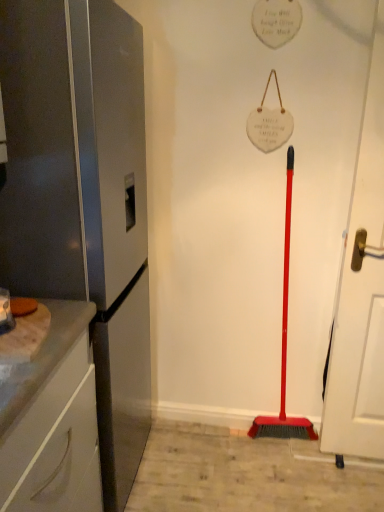
Question: From a real-world perspective, does satin silver refrigerator at left sit lower than white glossy cabinet at left?

Choices:
 (A) yes
 (B) no

Answer: (B)

Question: Does satin silver refrigerator at left appear on the right side of white glossy cabinet at left?

Choices:
 (A) no
 (B) yes

Answer: (B)

Question: From the image's perspective, is satin silver refrigerator at left located above white glossy cabinet at left?

Choices:
 (A) no
 (B) yes

Answer: (B)

Question: Are satin silver refrigerator at left and white glossy cabinet at left located far from each other?

Choices:
 (A) no
 (B) yes

Answer: (A)

Question: Can you confirm if satin silver refrigerator at left is taller than white glossy cabinet at left?

Choices:
 (A) yes
 (B) no

Answer: (A)

Question: Does satin silver refrigerator at left have a lesser width compared to white glossy cabinet at left?

Choices:
 (A) no
 (B) yes

Answer: (A)

Question: Considering the relative positions of satin silver refrigerator at left and white matte door at right in the image provided, is satin silver refrigerator at left to the right of white matte door at right from the viewer's perspective?

Choices:
 (A) yes
 (B) no

Answer: (B)

Question: Is satin silver refrigerator at left outside white matte door at right?

Choices:
 (A) no
 (B) yes

Answer: (B)

Question: Is satin silver refrigerator at left looking in the opposite direction of white matte door at right?

Choices:
 (A) yes
 (B) no

Answer: (B)

Question: From a real-world perspective, is satin silver refrigerator at left physically below white matte door at right?

Choices:
 (A) no
 (B) yes

Answer: (B)

Question: Is satin silver refrigerator at left taller than white matte door at right?

Choices:
 (A) no
 (B) yes

Answer: (A)

Question: Considering the relative positions of satin silver refrigerator at left and white matte door at right in the image provided, is satin silver refrigerator at left to the left of white matte door at right from the viewer's perspective?

Choices:
 (A) yes
 (B) no

Answer: (A)

Question: Is white glossy cabinet at left further to camera compared to satin silver refrigerator at left?

Choices:
 (A) yes
 (B) no

Answer: (B)